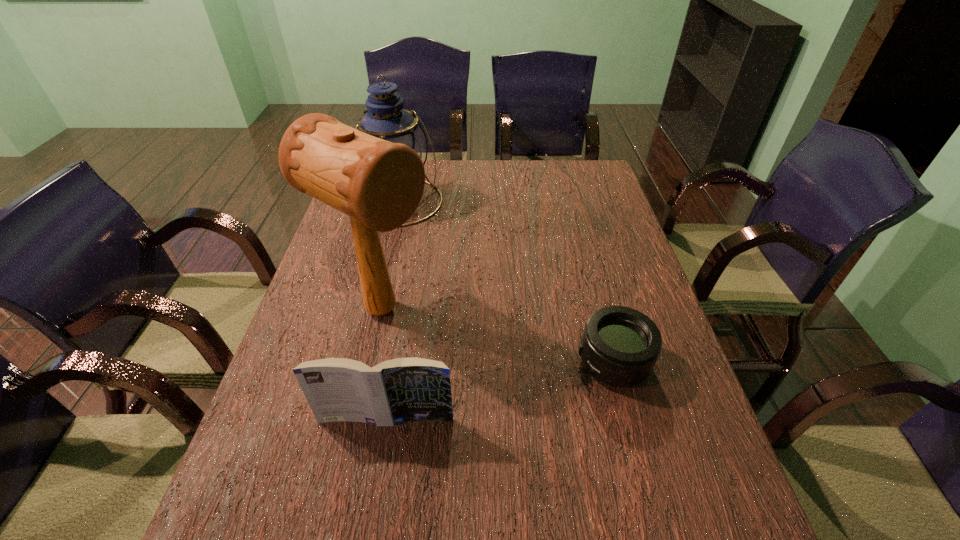
Identify the location of mallet located at the left edge. Image resolution: width=960 pixels, height=540 pixels. (379, 184).

This screenshot has height=540, width=960. In order to click on object situated at the right edge in this screenshot , I will do `click(620, 346)`.

At what (x,y) coordinates should I click in order to perform the action: click on object that is positioned at the far left corner. Please return your answer as a coordinate pair (x, y). Looking at the image, I should click on (386, 119).

Find the location of `free region at the far edge of the desktop`. free region at the far edge of the desktop is located at coordinates (496, 183).

At what (x,y) coordinates should I click in order to perform the action: click on vacant space at the left edge of the desktop. Please return your answer as a coordinate pair (x, y). The height and width of the screenshot is (540, 960). Looking at the image, I should click on point(321,346).

I want to click on vacant area at the right edge, so click(x=627, y=297).

Locate an element on the screen. This screenshot has height=540, width=960. vacant area at the far right corner of the desktop is located at coordinates (593, 192).

This screenshot has height=540, width=960. In order to click on free area in between the book and the lantern in this screenshot , I will do `click(393, 310)`.

Locate an element on the screen. vacant space in between the mallet and the rightmost object is located at coordinates (497, 336).

Find the location of a particular element. Image resolution: width=960 pixels, height=540 pixels. free spot between the mallet and the third shortest object is located at coordinates (391, 256).